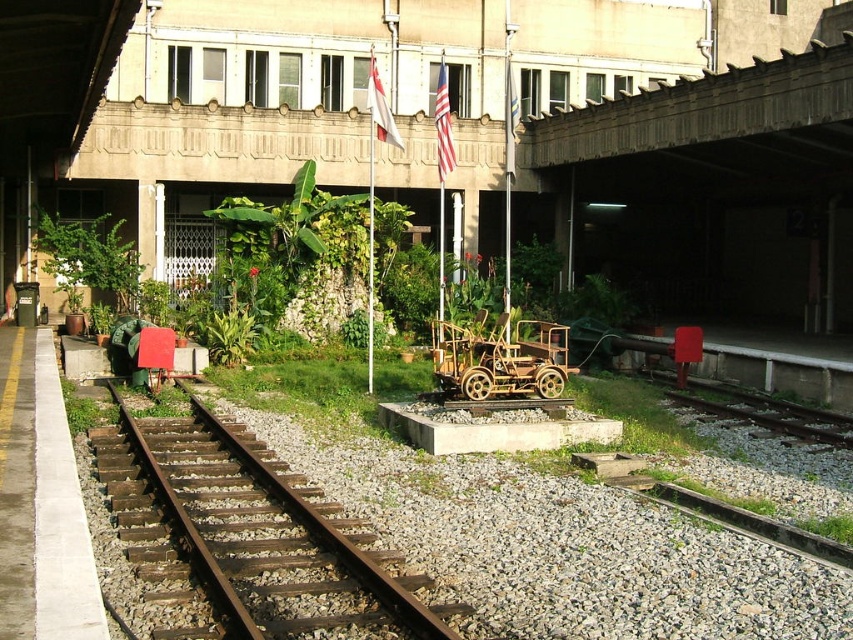
You are a maintenance worker at the station. You need to inspect both the rusty metal train track at center and the concrete textured overpass at upper center. Based on their positions, which object should you check first if you are standing on the platform?

You should check the rusty metal train track at center first because it is positioned on the left side of the concrete textured overpass at upper center, meaning it is closer to your current position on the platform.

You are standing at the railway station and see two points marked in the scene. Which point is nearer to you, point (360, 556) or point (764, 129)?

Point (360, 556) is closer to the viewer than point (764, 129).